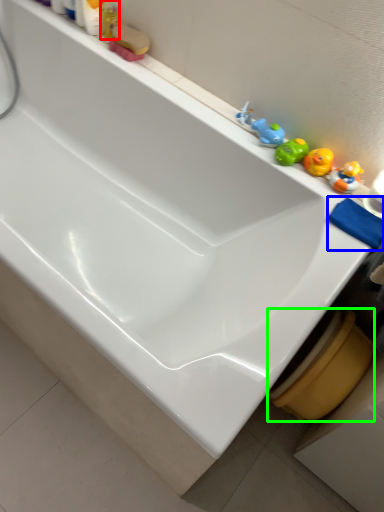
Question: Considering the real-world distances, which object is farthest from toiletry (highlighted by a red box)? bath towel (highlighted by a blue box) or toilet bowl (highlighted by a green box)?

Choices:
 (A) bath towel
 (B) toilet bowl

Answer: (B)